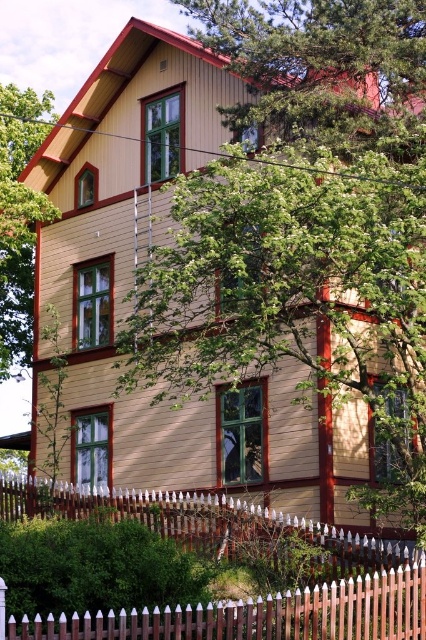
Does green leafy tree at upper center have a lesser height compared to green leafy tree at left?

Yes.

Which is in front, point (262, 76) or point (22, 138)?

Positioned in front is point (262, 76).

Between point (287, 67) and point (3, 321), which one is positioned behind?

The point (3, 321) is more distant.

The image size is (426, 640). Find the location of `green leafy tree at upper center`. green leafy tree at upper center is located at coordinates (322, 65).

This screenshot has width=426, height=640. I want to click on brown wooden fence at lower center, so click(256, 614).

I want to click on brown wooden fence at lower center, so click(256, 614).

Does green leafy tree at upper center have a larger size compared to brown wooden fence at lower center?

Yes.

Between green leafy tree at upper center and brown wooden fence at lower center, which one is positioned higher?

Positioned higher is green leafy tree at upper center.

Where is `green leafy tree at upper center`? green leafy tree at upper center is located at coordinates tap(322, 65).

This screenshot has width=426, height=640. I want to click on green leafy tree at upper center, so click(322, 65).